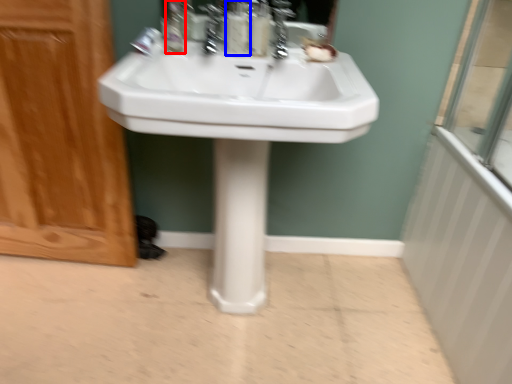
Question: Which object appears farthest to the camera in this image, mouthwash (highlighted by a red box) or soap dispenser (highlighted by a blue box)?

Choices:
 (A) mouthwash
 (B) soap dispenser

Answer: (B)